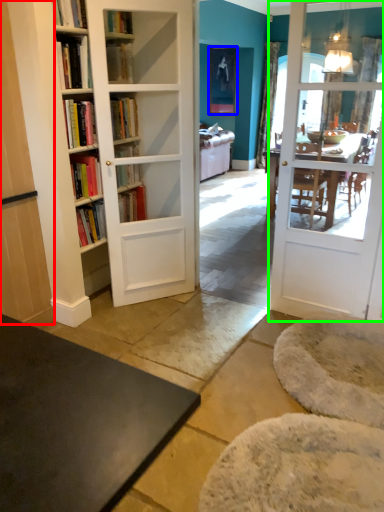
Question: Which object is the farthest from cabinetry (highlighted by a red box)? Choose among these: picture frame (highlighted by a blue box) or door (highlighted by a green box).

Choices:
 (A) picture frame
 (B) door

Answer: (A)